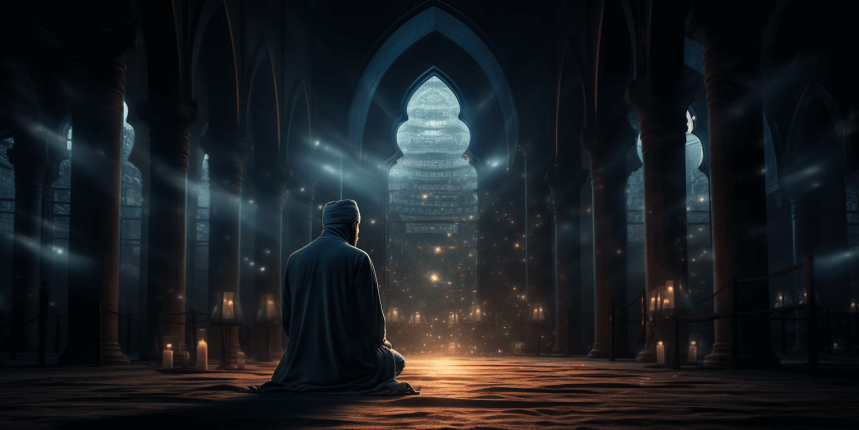
Image resolution: width=859 pixels, height=430 pixels. Identify the location of candle. (168, 362), (199, 359), (658, 353), (691, 356).